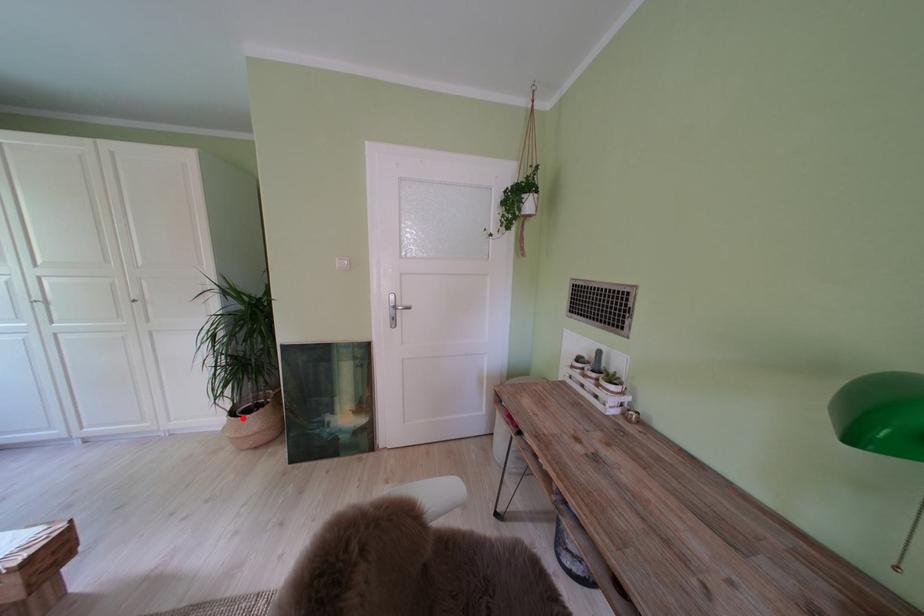
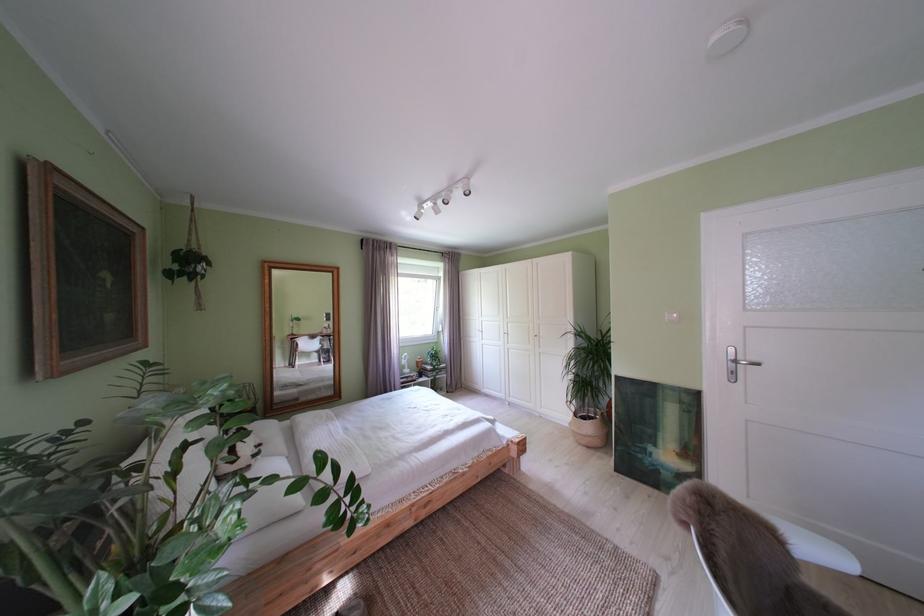
In the second image, find the point that corresponds to the highlighted location in the first image.

(587, 419)